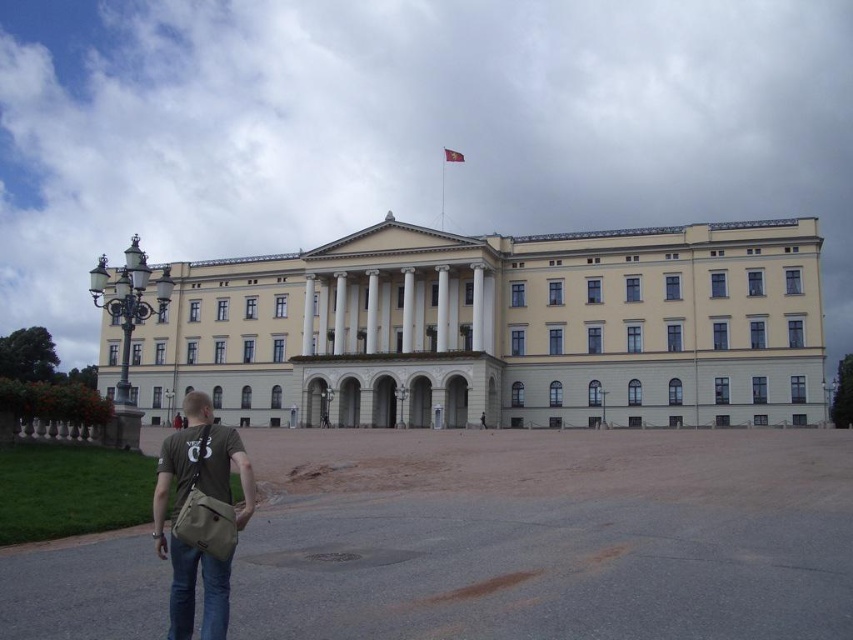
Does gold metallic flag at upper center appear on the right side of green fabric backpack at lower left?

Indeed, gold metallic flag at upper center is positioned on the right side of green fabric backpack at lower left.

Is gold metallic flag at upper center shorter than green fabric backpack at lower left?

No, gold metallic flag at upper center is not shorter than green fabric backpack at lower left.

Is point (457, 157) positioned behind point (178, 416)?

Yes, point (457, 157) is behind point (178, 416).

Locate an element on the screen. This screenshot has width=853, height=640. gold metallic flag at upper center is located at coordinates (x=451, y=156).

Does point (457, 156) come in front of point (480, 420)?

That is False.

Does gold metallic flag at upper center appear on the right side of brown leather backpack at lower center?

In fact, gold metallic flag at upper center is to the left of brown leather backpack at lower center.

Which is behind, point (451, 154) or point (480, 422)?

Point (451, 154)

Where is `gold metallic flag at upper center`? Image resolution: width=853 pixels, height=640 pixels. gold metallic flag at upper center is located at coordinates (451, 156).

Who is shorter, yellow stone building at center or brown leather backpack at lower center?

With less height is brown leather backpack at lower center.

Which is behind, point (473, 252) or point (483, 413)?

Positioned behind is point (473, 252).

Between point (799, 410) and point (485, 426), which one is positioned in front?

Point (799, 410)

Image resolution: width=853 pixels, height=640 pixels. Find the location of `yellow stone building at center`. yellow stone building at center is located at coordinates (500, 330).